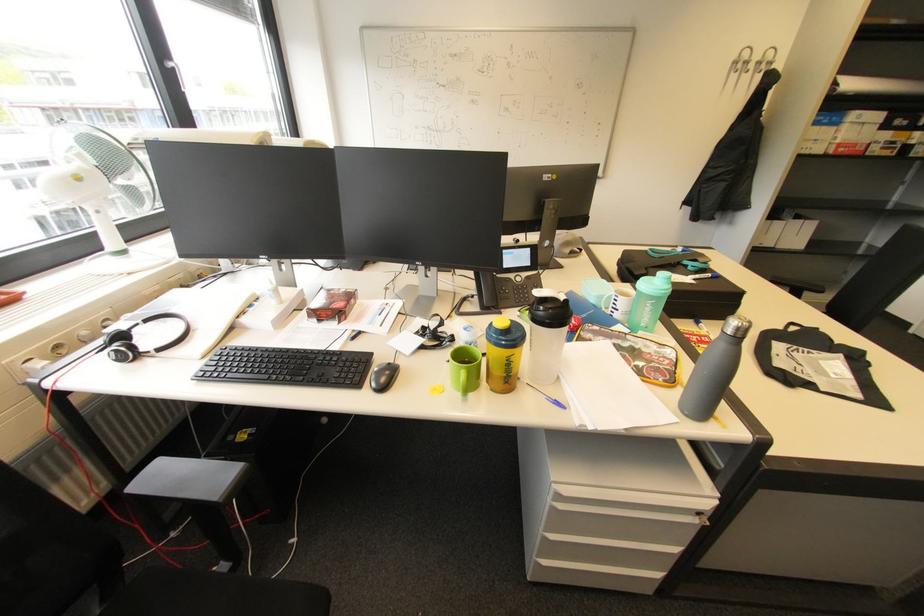
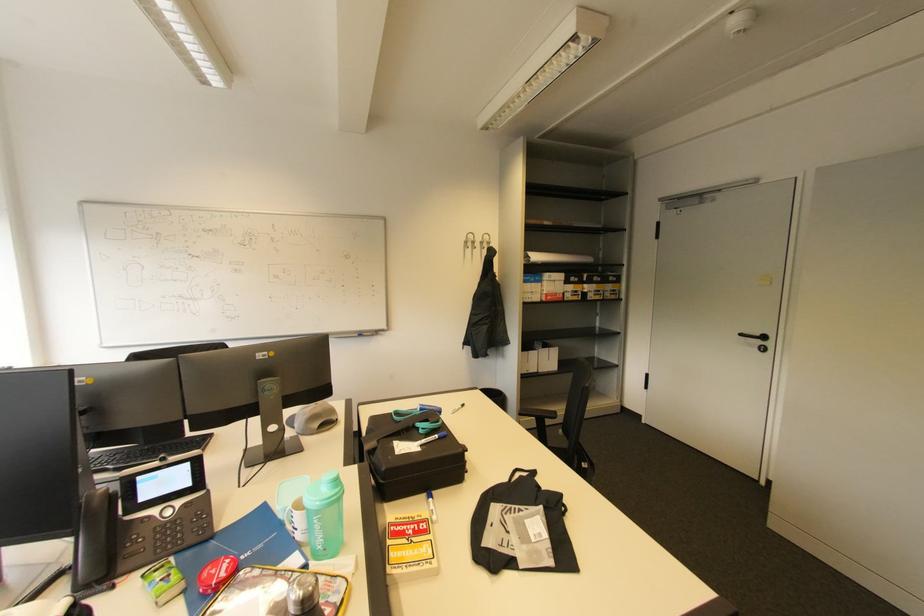
Locate, in the second image, the point that corresponds to the point at 740,63 in the first image.

(470, 243)